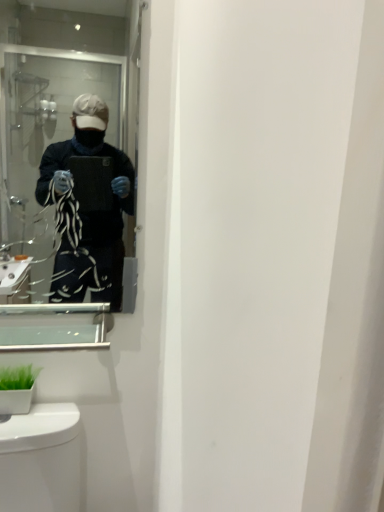
Question: Can clear glass medicine cabinet at lower left be found inside clear glass mirror at upper left?

Choices:
 (A) no
 (B) yes

Answer: (A)

Question: Considering the relative sizes of clear glass mirror at upper left and clear glass medicine cabinet at lower left in the image provided, is clear glass mirror at upper left smaller than clear glass medicine cabinet at lower left?

Choices:
 (A) no
 (B) yes

Answer: (A)

Question: Is clear glass mirror at upper left further to the viewer compared to clear glass medicine cabinet at lower left?

Choices:
 (A) no
 (B) yes

Answer: (A)

Question: From a real-world perspective, does clear glass mirror at upper left stand above clear glass medicine cabinet at lower left?

Choices:
 (A) no
 (B) yes

Answer: (B)

Question: Is clear glass mirror at upper left aimed at clear glass medicine cabinet at lower left?

Choices:
 (A) no
 (B) yes

Answer: (B)

Question: Can you confirm if clear glass mirror at upper left is thinner than clear glass medicine cabinet at lower left?

Choices:
 (A) yes
 (B) no

Answer: (A)

Question: Considering the relative sizes of clear glass medicine cabinet at lower left and clear glass mirror at upper left in the image provided, is clear glass medicine cabinet at lower left wider than clear glass mirror at upper left?

Choices:
 (A) no
 (B) yes

Answer: (B)

Question: Does clear glass medicine cabinet at lower left have a greater height compared to clear glass mirror at upper left?

Choices:
 (A) no
 (B) yes

Answer: (A)

Question: From a real-world perspective, is clear glass medicine cabinet at lower left below clear glass mirror at upper left?

Choices:
 (A) no
 (B) yes

Answer: (B)

Question: Considering the relative sizes of clear glass medicine cabinet at lower left and clear glass mirror at upper left in the image provided, is clear glass medicine cabinet at lower left shorter than clear glass mirror at upper left?

Choices:
 (A) no
 (B) yes

Answer: (B)

Question: Does clear glass medicine cabinet at lower left have a lesser width compared to clear glass mirror at upper left?

Choices:
 (A) yes
 (B) no

Answer: (B)

Question: Could clear glass mirror at upper left be considered to be inside clear glass medicine cabinet at lower left?

Choices:
 (A) yes
 (B) no

Answer: (B)

Question: From a real-world perspective, is green matte plant at lower left below clear glass mirror at upper left?

Choices:
 (A) yes
 (B) no

Answer: (A)